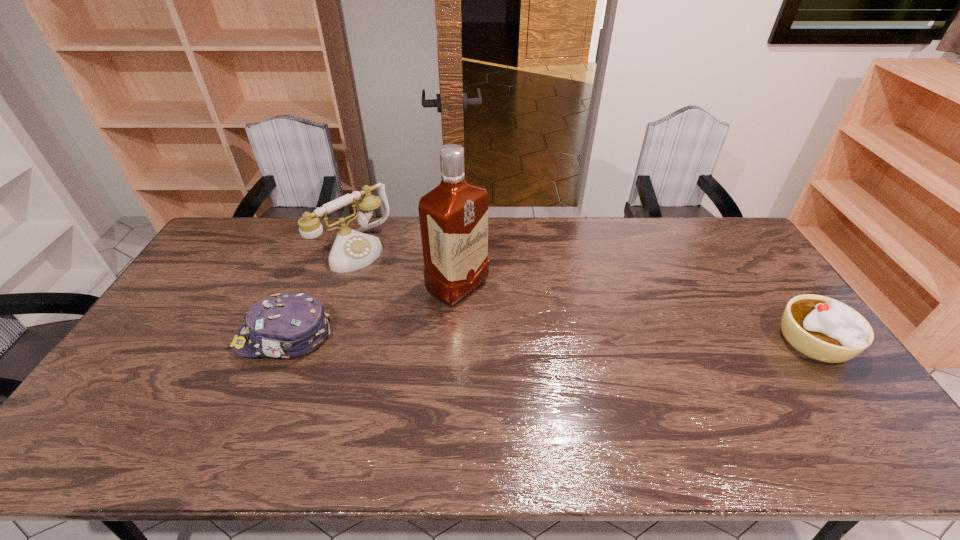
Locate an element on the screen. This screenshot has width=960, height=540. vacant space located 0.220m on the front label of the liquor is located at coordinates (539, 340).

I want to click on blank space located on the front label of the liquor, so click(564, 357).

Locate an element on the screen. This screenshot has height=540, width=960. vacant area situated 0.120m on the front label of the liquor is located at coordinates (511, 322).

This screenshot has height=540, width=960. Identify the location of free location located 0.340m on the dial of the third shortest object. (442, 316).

Identify the location of free space located on the dial of the third shortest object. (404, 287).

Where is `vacant space situated 0.110m on the dial of the third shortest object`? The width and height of the screenshot is (960, 540). vacant space situated 0.110m on the dial of the third shortest object is located at coordinates (395, 280).

Where is `object positioned at the far edge`? The image size is (960, 540). object positioned at the far edge is located at coordinates (352, 250).

Locate an element on the screen. object at the right edge is located at coordinates (824, 329).

The width and height of the screenshot is (960, 540). Find the location of `free spot at the far edge of the desktop`. free spot at the far edge of the desktop is located at coordinates (300, 234).

The height and width of the screenshot is (540, 960). In order to click on vacant space at the near edge of the desktop in this screenshot , I will do 636,399.